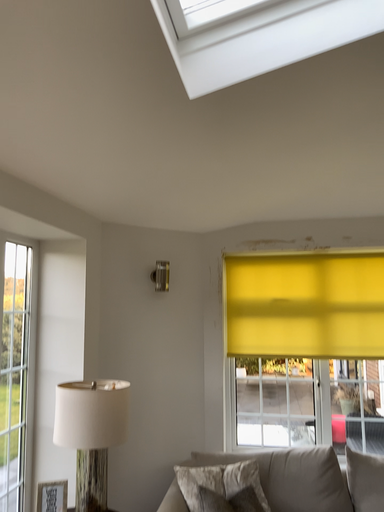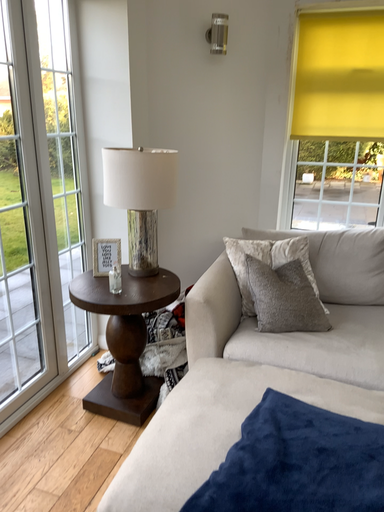
Question: How did the camera likely rotate when shooting the video?

Choices:
 (A) rotated downward
 (B) rotated upward

Answer: (A)